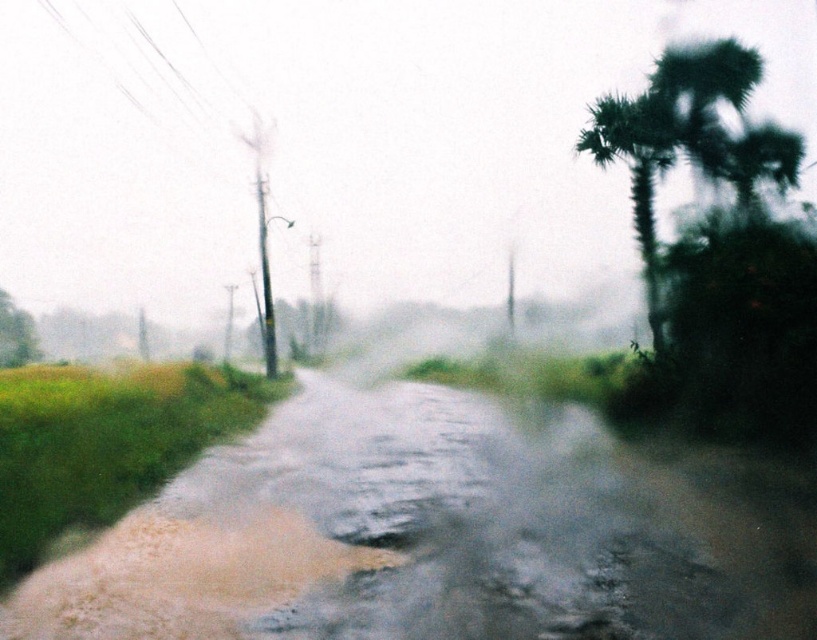
Question: Considering the relative positions of green leafy palm tree at right and green leafy tree at left in the image provided, where is green leafy palm tree at right located with respect to green leafy tree at left?

Choices:
 (A) left
 (B) right

Answer: (B)

Question: Does brown mud at center appear on the right side of green leafy tree at left?

Choices:
 (A) no
 (B) yes

Answer: (B)

Question: Estimate the real-world distances between objects in this image. Which object is farther from the brown mud at center?

Choices:
 (A) green leafy palm tree at right
 (B) green leafy tree at left

Answer: (B)

Question: Considering the real-world distances, which object is closest to the brown mud at center?

Choices:
 (A) green leafy palm tree at right
 (B) green leafy tree at left

Answer: (A)

Question: Which point is closer to the camera taking this photo?

Choices:
 (A) (36, 337)
 (B) (659, 124)

Answer: (B)

Question: Can you confirm if brown mud at center is positioned below green leafy tree at left?

Choices:
 (A) no
 (B) yes

Answer: (B)